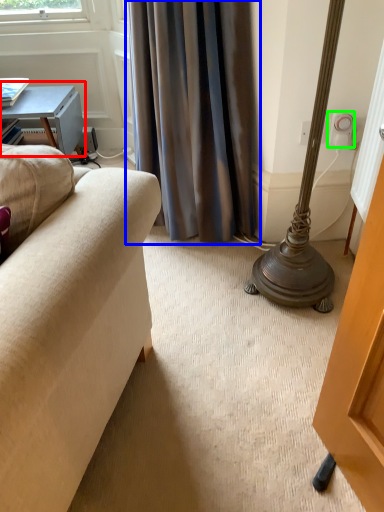
Question: Considering the real-world distances, which object is farthest from table (highlighted by a red box)? curtain (highlighted by a blue box) or electric outlet (highlighted by a green box)?

Choices:
 (A) curtain
 (B) electric outlet

Answer: (B)